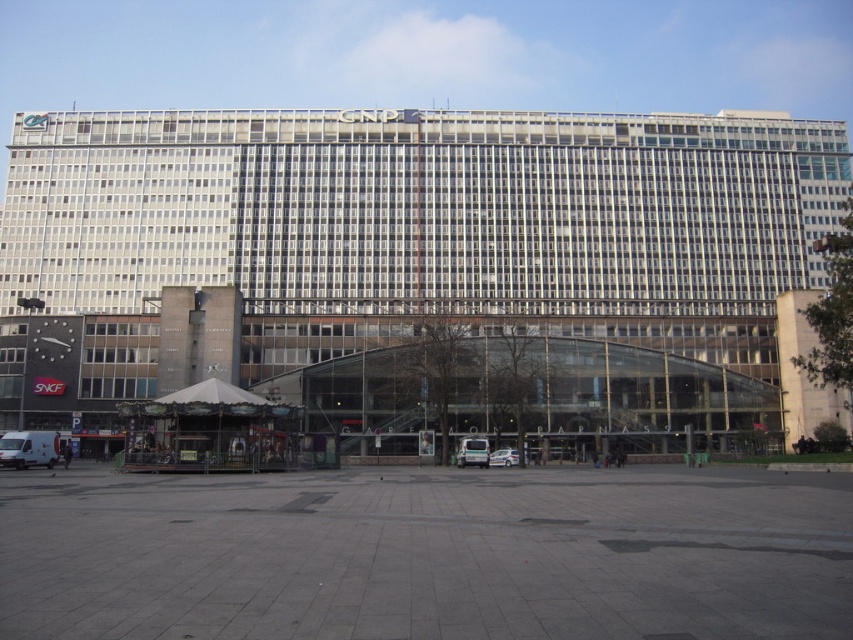
Question: Observing the image, what is the correct spatial positioning of gray concrete plaza at center in reference to white matte van at lower left?

Choices:
 (A) below
 (B) above

Answer: (B)

Question: Is gray concrete plaza at center smaller than white matte van at lower left?

Choices:
 (A) no
 (B) yes

Answer: (A)

Question: Among these objects, which one is nearest to the camera?

Choices:
 (A) gray concrete plaza at center
 (B) white matte van at lower left

Answer: (B)

Question: Based on their relative distances, which object is farther from the white matte van at lower left?

Choices:
 (A) gray concrete plaza at center
 (B) white glossy car at center

Answer: (A)

Question: Can you confirm if gray concrete plaza at center is bigger than white glossy car at center?

Choices:
 (A) no
 (B) yes

Answer: (B)

Question: Among these objects, which one is farthest from the camera?

Choices:
 (A) gray concrete plaza at center
 (B) white matte van at lower left

Answer: (A)